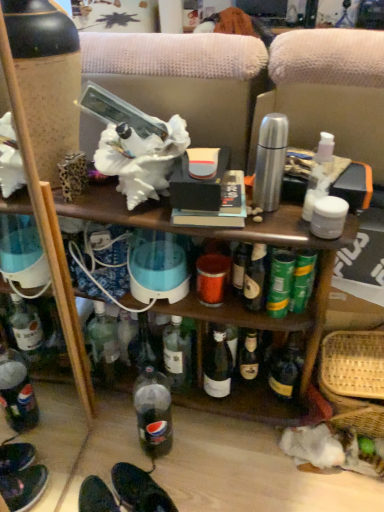
Question: Is woven straw basket at lower right bigger than black leather shoes at lower center?

Choices:
 (A) no
 (B) yes

Answer: (B)

Question: Are woven straw basket at lower right and black leather shoes at lower center far apart?

Choices:
 (A) yes
 (B) no

Answer: (B)

Question: Is the depth of woven straw basket at lower right greater than that of black leather shoes at lower center?

Choices:
 (A) no
 (B) yes

Answer: (B)

Question: From a real-world perspective, is woven straw basket at lower right physically below black leather shoes at lower center?

Choices:
 (A) no
 (B) yes

Answer: (A)

Question: From the image's perspective, would you say woven straw basket at lower right is shown under black leather shoes at lower center?

Choices:
 (A) yes
 (B) no

Answer: (B)

Question: Is woven straw basket at lower right at the left side of black leather shoes at lower center?

Choices:
 (A) yes
 (B) no

Answer: (B)

Question: Is black leather shoes at lower center next to woven straw basket at lower right?

Choices:
 (A) yes
 (B) no

Answer: (B)

Question: Is there a large distance between black leather shoes at lower center and woven straw basket at lower right?

Choices:
 (A) no
 (B) yes

Answer: (A)

Question: From a real-world perspective, is black leather shoes at lower center beneath woven straw basket at lower right?

Choices:
 (A) no
 (B) yes

Answer: (B)

Question: Can you confirm if black leather shoes at lower center is taller than woven straw basket at lower right?

Choices:
 (A) no
 (B) yes

Answer: (A)

Question: Considering the relative sizes of black leather shoes at lower center and woven straw basket at lower right in the image provided, is black leather shoes at lower center wider than woven straw basket at lower right?

Choices:
 (A) no
 (B) yes

Answer: (A)

Question: Is black leather shoes at lower center behind woven straw basket at lower right?

Choices:
 (A) no
 (B) yes

Answer: (A)

Question: Considering the positions of woven straw basket at lower right and black leather shoes at lower center in the image, is woven straw basket at lower right wider or thinner than black leather shoes at lower center?

Choices:
 (A) wide
 (B) thin

Answer: (A)